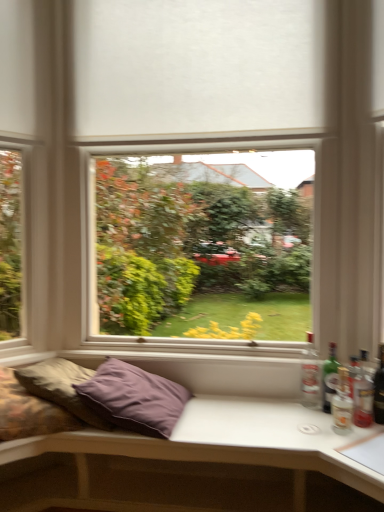
You are a GUI agent. You are given a task and a screenshot of the screen. Output one action in this format:
    pyautogui.click(x=<x>, y=<y>)
    Task: Click on the vacant region to the left of green glass bottle at right, arranged as the 2th bottle when viewed from the right
    Image resolution: width=384 pixels, height=512 pixels.
    Given the screenshot: What is the action you would take?
    pyautogui.click(x=294, y=412)